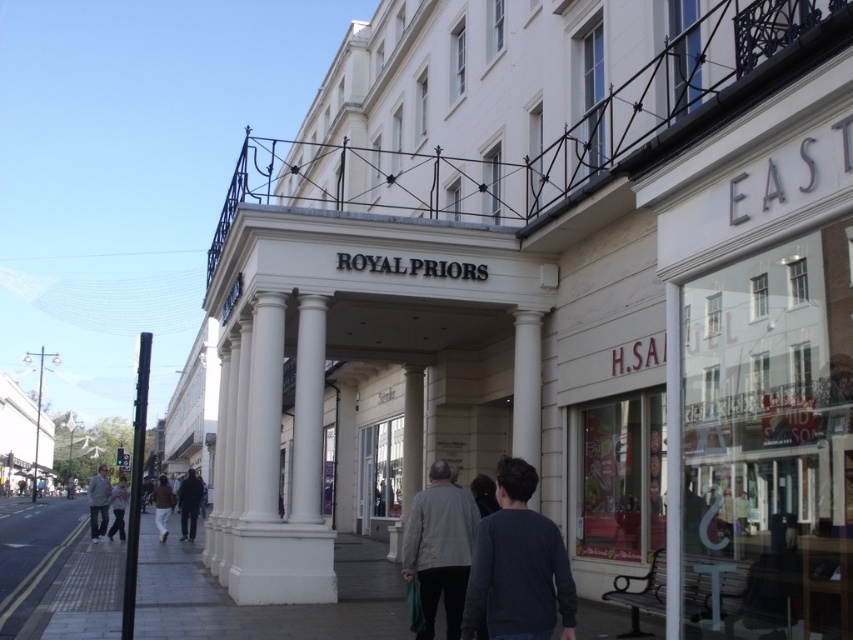
Who is higher up, gray concrete pavement at center or light gray fabric jacket at lower left?

gray concrete pavement at center

Does gray concrete pavement at center have a greater width compared to light gray fabric jacket at lower left?

No, gray concrete pavement at center is not wider than light gray fabric jacket at lower left.

Is point (204, 600) positioned after point (107, 502)?

That is False.

The image size is (853, 640). I want to click on gray concrete pavement at center, so click(264, 605).

Identify the location of gray concrete pavement at center. This screenshot has height=640, width=853. (264, 605).

What are the coordinates of `gray concrete pavement at center` in the screenshot? It's located at (264, 605).

Is light gray fabric jacket at center to the left of brown leather jacket at lower left from the viewer's perspective?

No, light gray fabric jacket at center is not to the left of brown leather jacket at lower left.

Does light gray fabric jacket at center appear under brown leather jacket at lower left?

No, light gray fabric jacket at center is not below brown leather jacket at lower left.

This screenshot has width=853, height=640. What do you see at coordinates (439, 547) in the screenshot?
I see `light gray fabric jacket at center` at bounding box center [439, 547].

Where is `light gray fabric jacket at center`? The height and width of the screenshot is (640, 853). light gray fabric jacket at center is located at coordinates (439, 547).